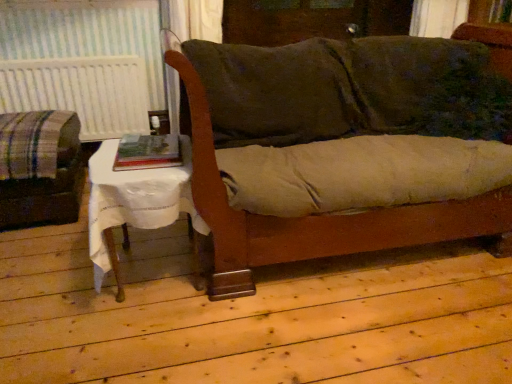
You are a GUI agent. You are given a task and a screenshot of the screen. Output one action in this format:
    pyautogui.click(x=<x>, y=<y>)
    Task: Click on the vacant space to the right of white cloth-covered table at lower left
    Image resolution: width=512 pixels, height=384 pixels.
    Given the screenshot: What is the action you would take?
    pyautogui.click(x=266, y=301)